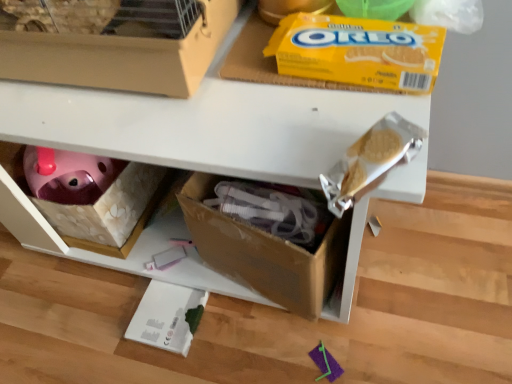
Where is `free space to the left of yellow cardboard oreo at upper center`? This screenshot has height=384, width=512. free space to the left of yellow cardboard oreo at upper center is located at coordinates (234, 94).